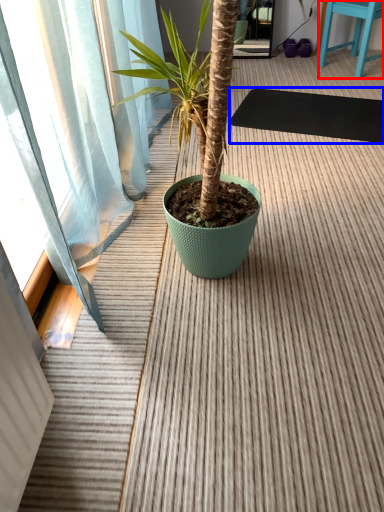
Question: Which object appears farthest to the camera in this image, furniture (highlighted by a red box) or yoga mat (highlighted by a blue box)?

Choices:
 (A) furniture
 (B) yoga mat

Answer: (A)